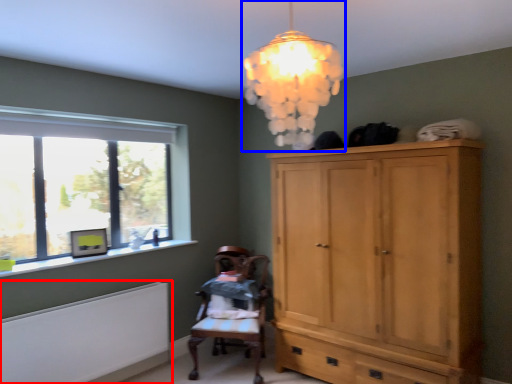
Question: Which object is further to the camera taking this photo, radiator (highlighted by a red box) or lamp (highlighted by a blue box)?

Choices:
 (A) radiator
 (B) lamp

Answer: (A)